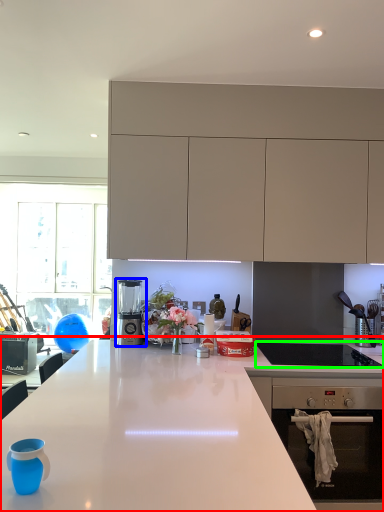
Question: Which object is the closest to the countertop (highlighted by a red box)? Choose among these: kitchen appliance (highlighted by a blue box) or gas stove (highlighted by a green box).

Choices:
 (A) kitchen appliance
 (B) gas stove

Answer: (B)